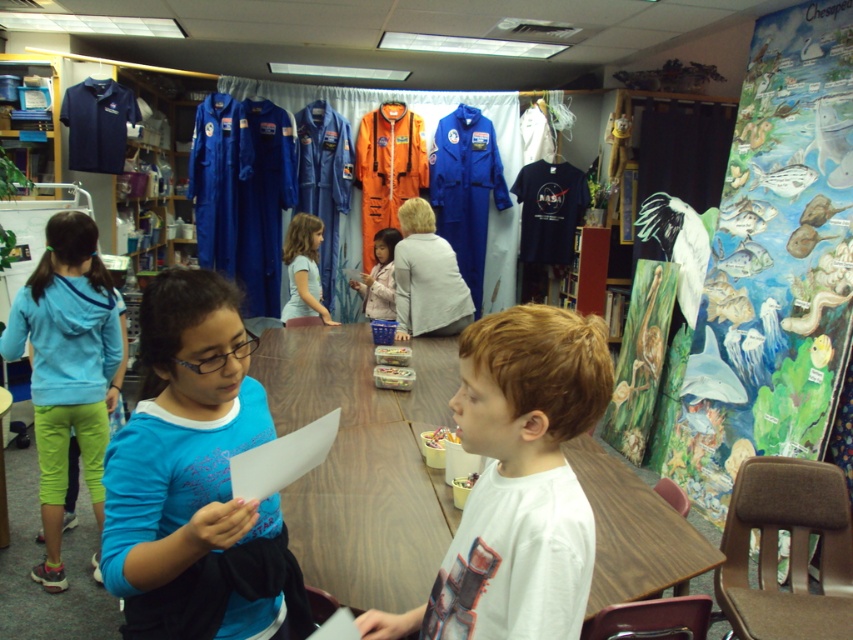
You are a student sitting at the wooden table in the classroom. You notice two points marked on the wall behind the table. One is at coordinate point [294,216] and the other is at coordinate point [364,305]. Which point is closer to you?

Point [294,216] is closer to the viewer than point [364,305].

You are standing in the classroom and want to reach the point marked as point (567, 435). If your arm can reach 3 feet, can you reach that point without moving?

The distance between you and point (567, 435) is 3.49 feet, which is longer than your arm reach of 3 feet. Therefore, you cannot reach it without moving.

You are a teacher in the classroom and need to hang a picture on the wall between the white matte shirt at center and the light blue fleece jacket at lower left. Which object should you place the picture closer to so that it hangs at the same height as the taller object?

The light blue fleece jacket at lower left is taller than the white matte shirt at center, so you should place the picture closer to the light blue fleece jacket at lower left to match its height.